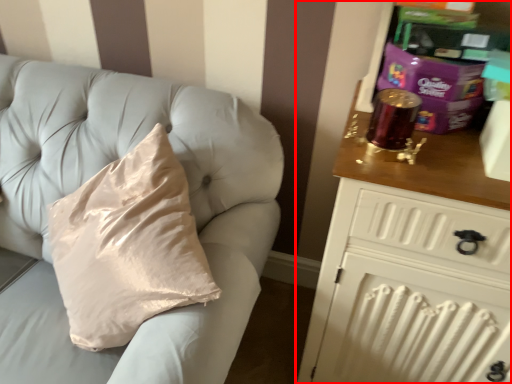
Question: From the image's perspective, considering the relative positions of chest of drawers (annotated by the red box) and furniture in the image provided, where is chest of drawers (annotated by the red box) located with respect to the staircase?

Choices:
 (A) below
 (B) above

Answer: (A)